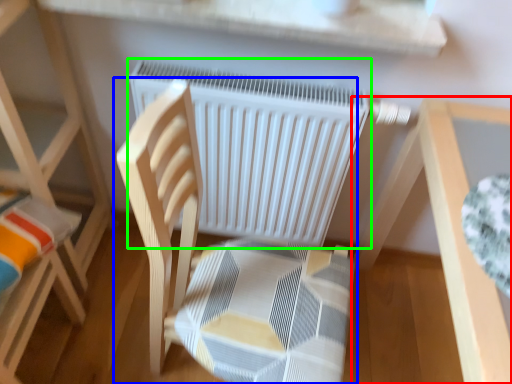
Question: Which object is positioned farthest from table (highlighted by a red box)? Select from chair (highlighted by a blue box) and radiator (highlighted by a green box).

Choices:
 (A) chair
 (B) radiator

Answer: (A)